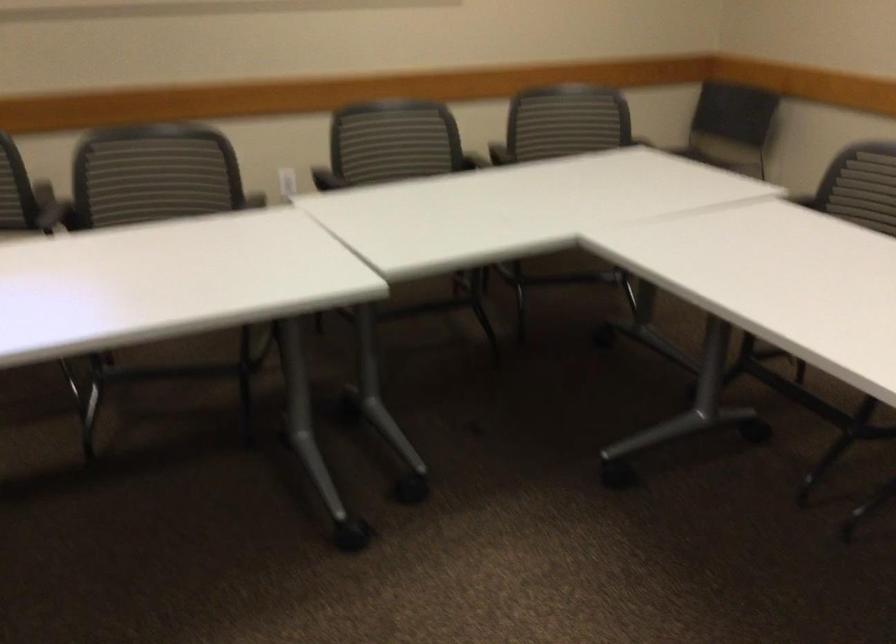
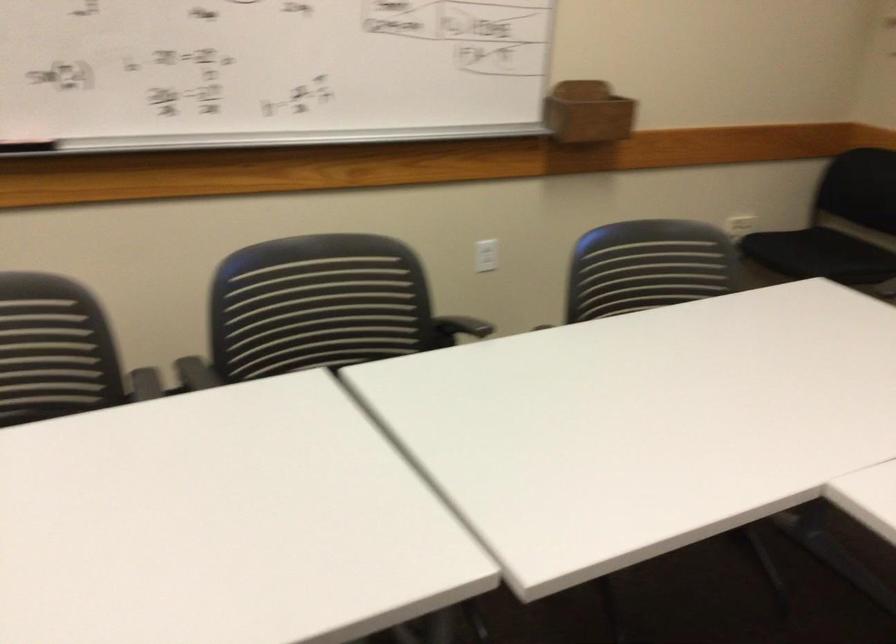
The images are taken continuously from a first-person perspective. In which direction is your viewpoint rotating?

The camera rotated toward left-down.